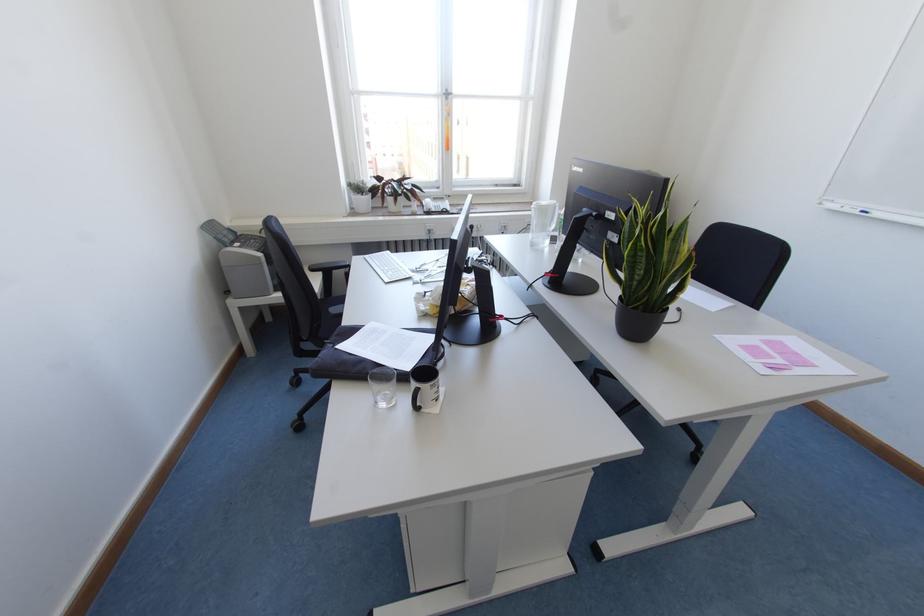
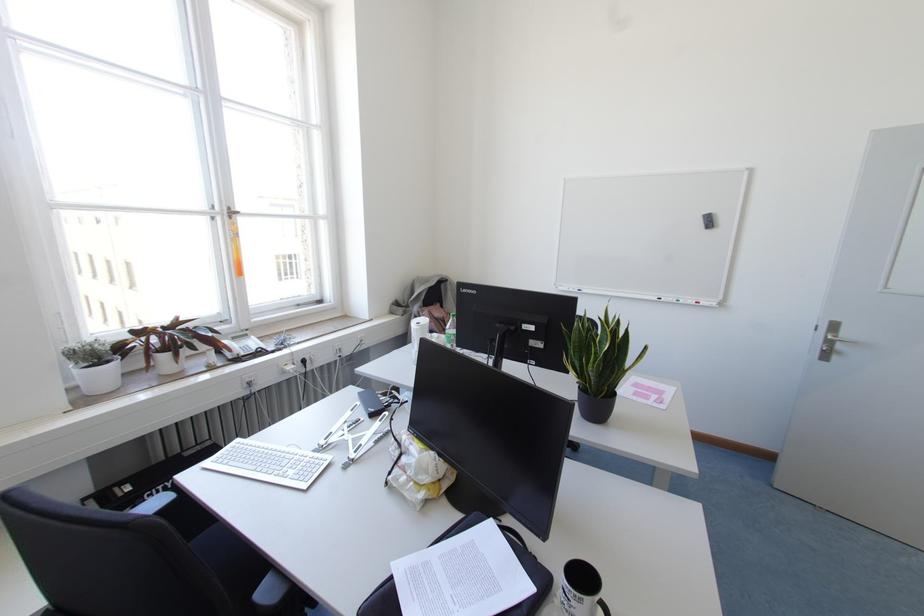
The point at (446, 98) is marked in the first image. Where is the corresponding point in the second image?

(229, 217)